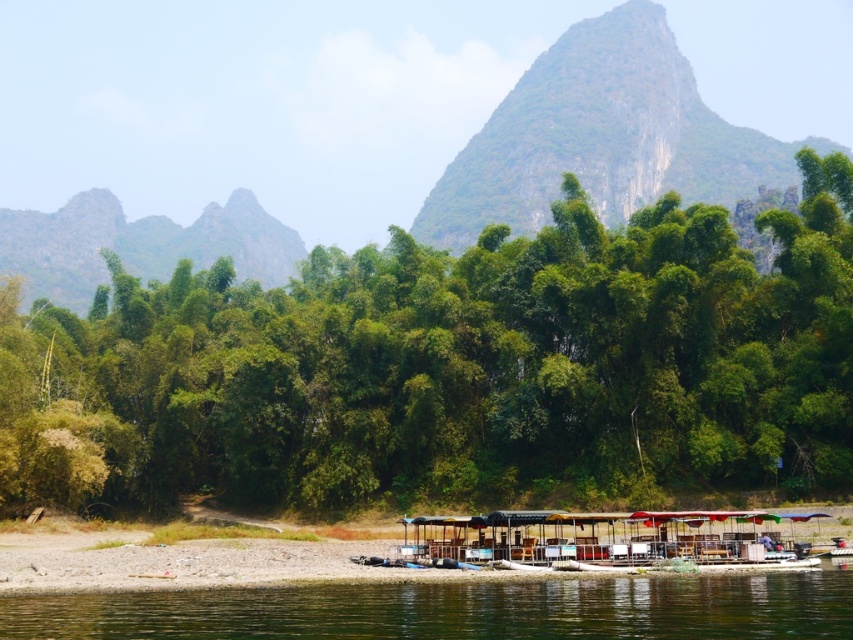
You are standing at the riverside and want to reach a specific location. You see two points marked in the image. Which point is closer to you, the point at coordinate (x=490, y=468) or the point at coordinate (x=51, y=248)?

The point at coordinate (x=490, y=468) is closer to you than the point at coordinate (x=51, y=248).

You are a hiker planning to take a photo of the green leafy trees at center and the rocky gray mountain at upper left. Which object will appear wider in your camera view?

The rocky gray mountain at upper left will appear wider in your camera view because its width is greater than the green leafy trees at center.

You are standing at the point marked as point (459,368) in the image. What object is right in front of you?

The green leafy trees at center is located at point (459,368), so the object right in front of you is the green leafy trees at center.